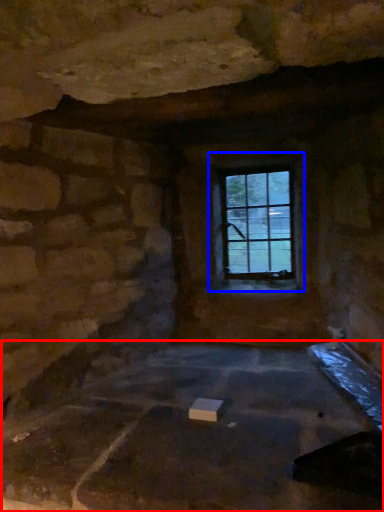
Question: Which of the following is the closest to the observer, foundation (highlighted by a red box) or window (highlighted by a blue box)?

Choices:
 (A) foundation
 (B) window

Answer: (A)